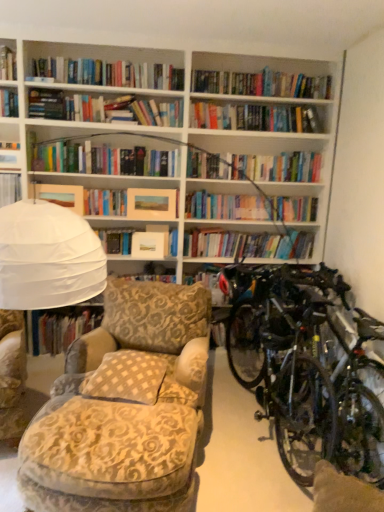
In order to click on blank space above matte paper picture frame at center, which is the 3th paperback book in left-to-right order (from a real-world perspective) in this screenshot , I will do `click(158, 183)`.